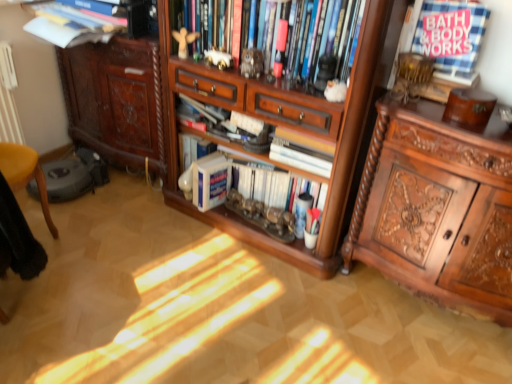
You are a GUI agent. You are given a task and a screenshot of the screen. Output one action in this format:
    pyautogui.click(x=<x>, y=<y>)
    Task: Click on the free space between polished wood cabinet at right, the 1th cabinetry positioned from the right, and wooden cabinet at center
    
    Given the screenshot: What is the action you would take?
    pyautogui.click(x=393, y=316)